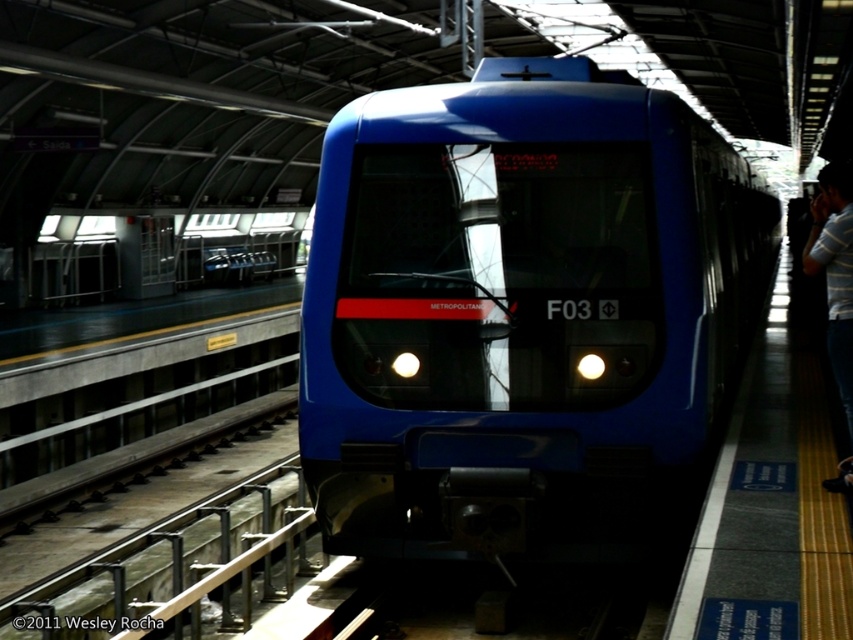
Which is in front, point (595, 420) or point (845, 460)?

Point (845, 460)

Image resolution: width=853 pixels, height=640 pixels. What do you see at coordinates (519, 310) in the screenshot?
I see `blue glossy train at center` at bounding box center [519, 310].

Where is `blue glossy train at center`? blue glossy train at center is located at coordinates (519, 310).